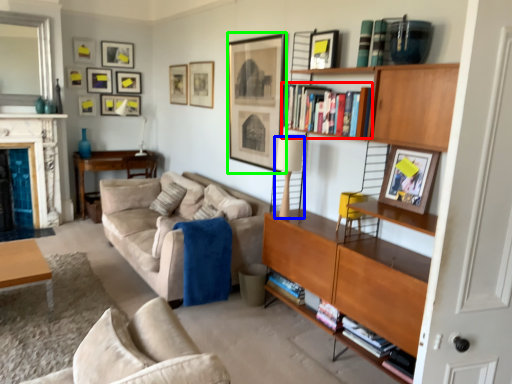
Question: Considering the real-world distances, which object is closest to book (highlighted by a red box)? lamp (highlighted by a blue box) or picture frame (highlighted by a green box).

Choices:
 (A) lamp
 (B) picture frame

Answer: (A)